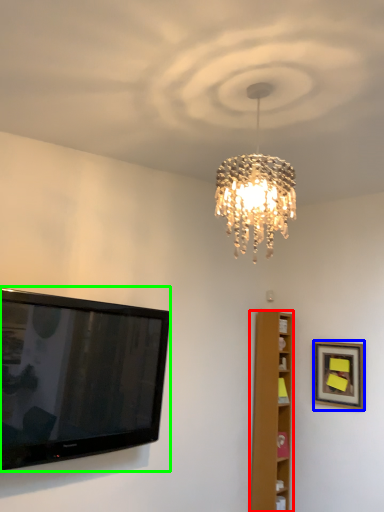
Question: Estimate the real-world distances between objects in this image. Which object is farther from furniture (highlighted by a red box), picture frame (highlighted by a blue box) or television (highlighted by a green box)?

Choices:
 (A) picture frame
 (B) television

Answer: (B)